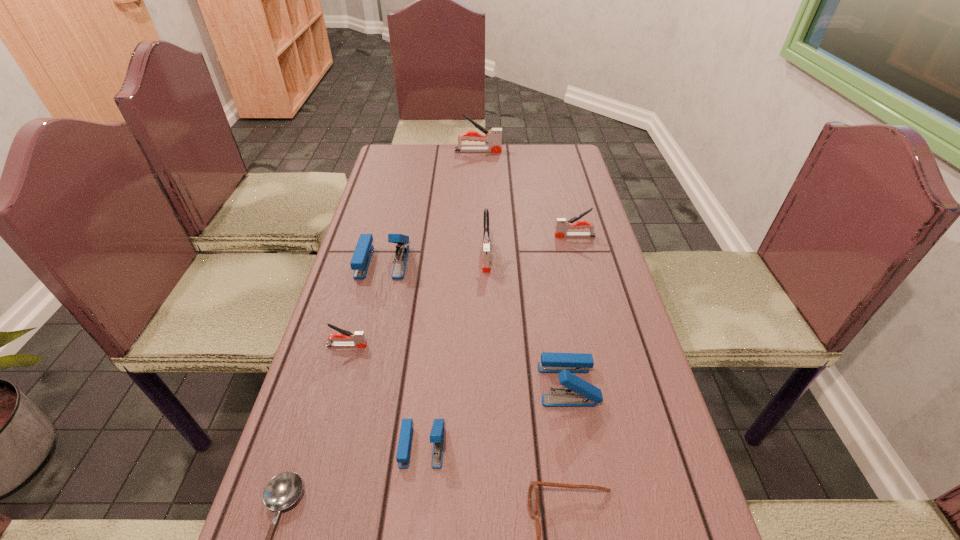
Locate an element on the screen. This screenshot has height=540, width=960. the third nearest stapler is located at coordinates (358, 337).

Locate an element on the screen. The width and height of the screenshot is (960, 540). the nearest stapler is located at coordinates (437, 432).

You are a GUI agent. You are given a task and a screenshot of the screen. Output one action in this format:
    pyautogui.click(x=<x>, y=<y>)
    Task: Click on the smallest blue stapler
    This screenshot has width=960, height=540.
    Given the screenshot: What is the action you would take?
    pyautogui.click(x=437, y=432)

What are the coordinates of `vacant space situated on the handle side of the tallest stapler` in the screenshot? It's located at (540, 151).

Locate an element on the screen. Image resolution: width=960 pixels, height=540 pixels. vacant space located on the handle side of the second biggest gray stapler is located at coordinates (488, 356).

This screenshot has height=540, width=960. Find the location of `free space located 0.080m on the front of the leftmost blue stapler`. free space located 0.080m on the front of the leftmost blue stapler is located at coordinates (372, 301).

Where is `blank area located on the handle side of the third nearest gray stapler`? This screenshot has width=960, height=540. blank area located on the handle side of the third nearest gray stapler is located at coordinates (524, 236).

Locate an element on the screen. The height and width of the screenshot is (540, 960). free location located on the handle side of the third nearest gray stapler is located at coordinates [x=461, y=236].

Locate an element on the screen. The height and width of the screenshot is (540, 960). free space located on the handle side of the third nearest gray stapler is located at coordinates (538, 236).

Find the location of `vacant point located 0.180m on the front of the sixth farthest stapler`. vacant point located 0.180m on the front of the sixth farthest stapler is located at coordinates (588, 500).